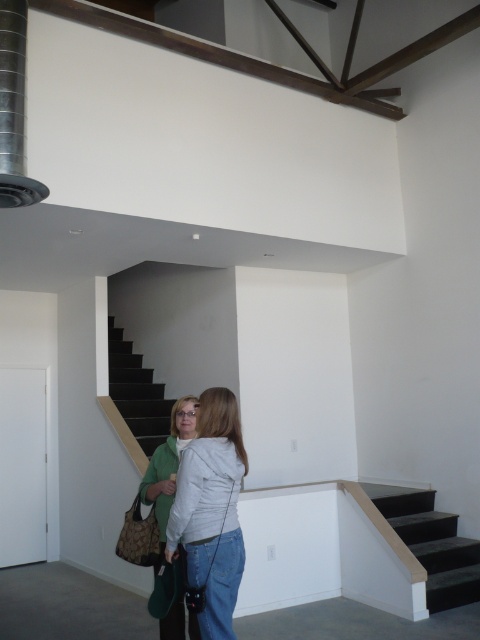
Who is shorter, white matte jacket at center or green fabric jacket at lower left?

Standing shorter between the two is green fabric jacket at lower left.

Is white matte jacket at center positioned before green fabric jacket at lower left?

Yes, it is.

This screenshot has height=640, width=480. I want to click on white matte jacket at center, so click(x=212, y=509).

Where is `white matte jacket at center`? This screenshot has height=640, width=480. white matte jacket at center is located at coordinates (212, 509).

Between dark gray carpeted stairs at lower right and green fabric jacket at lower left, which one appears on the left side from the viewer's perspective?

Positioned to the left is green fabric jacket at lower left.

Is dark gray carpeted stairs at lower right above green fabric jacket at lower left?

No.

Does point (428, 554) lie in front of point (165, 518)?

No.

Find the location of a particular element. dark gray carpeted stairs at lower right is located at coordinates (432, 544).

Can you confirm if white matte jacket at center is shorter than dark gray carpeted stairs at lower right?

No, white matte jacket at center is not shorter than dark gray carpeted stairs at lower right.

Is point (200, 568) farther from camera compared to point (396, 513)?

No, it is in front of (396, 513).

Which is behind, point (200, 412) or point (435, 602)?

Point (435, 602)

I want to click on white matte jacket at center, so click(212, 509).